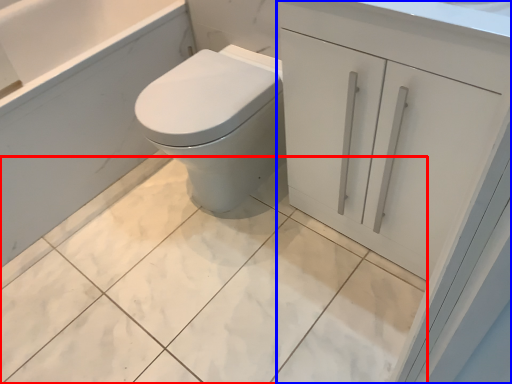
Question: Which object is closer to the camera taking this photo, ceramic tile (highlighted by a red box) or bathroom cabinet (highlighted by a blue box)?

Choices:
 (A) ceramic tile
 (B) bathroom cabinet

Answer: (B)